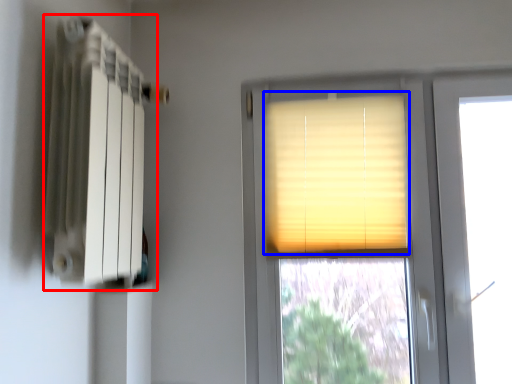
Question: Among these objects, which one is farthest to the camera, radiator (highlighted by a red box) or window blind (highlighted by a blue box)?

Choices:
 (A) radiator
 (B) window blind

Answer: (B)